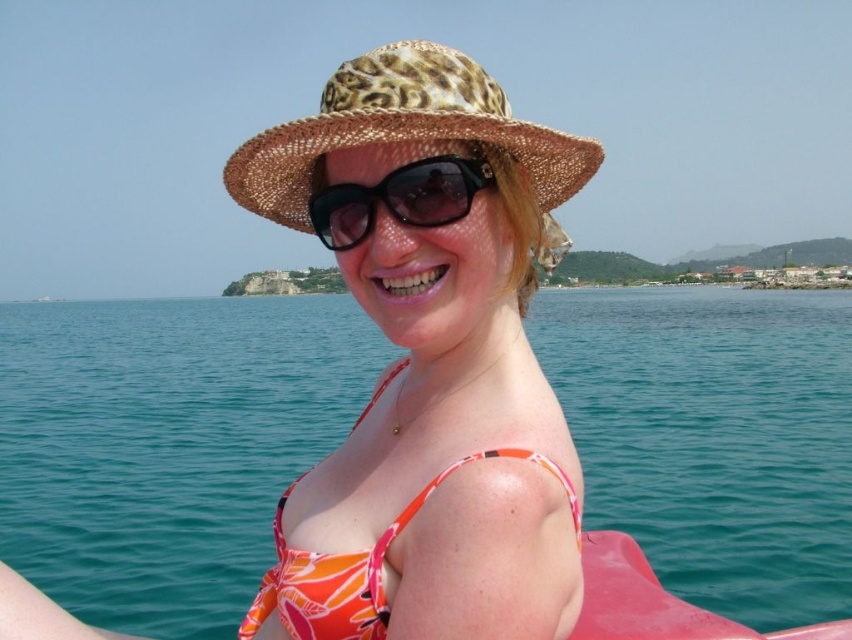
Question: Estimate the real-world distances between objects in this image. Which object is closer to the black matte sunglasses at center?

Choices:
 (A) leopard print hat at center
 (B) leopard print straw hat at center

Answer: (B)

Question: Is leopard print hat at center wider than orange printed bikini top at center?

Choices:
 (A) yes
 (B) no

Answer: (A)

Question: Does orange printed bikini top at center appear on the right side of black matte sunglasses at center?

Choices:
 (A) yes
 (B) no

Answer: (A)

Question: Which of the following is the closest to the observer?

Choices:
 (A) (521, 125)
 (B) (320, 579)

Answer: (B)

Question: Considering the real-world distances, which object is closest to the leopard print hat at center?

Choices:
 (A) orange printed bikini top at center
 (B) black matte sunglasses at center
 (C) leopard print straw hat at center

Answer: (B)

Question: Can you confirm if blue water at center is positioned above orange printed bikini top at center?

Choices:
 (A) no
 (B) yes

Answer: (B)